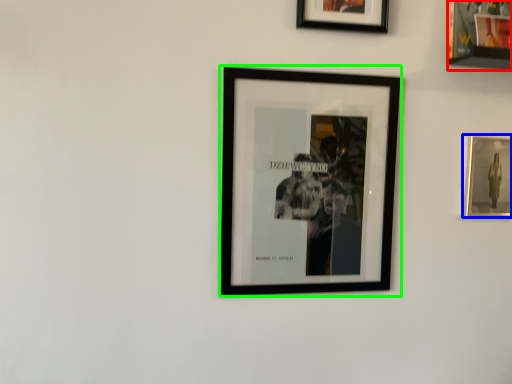
Question: Which object is the closest to the picture frame (highlighted by a red box)? Choose among these: picture frame (highlighted by a blue box) or picture frame (highlighted by a green box).

Choices:
 (A) picture frame
 (B) picture frame

Answer: (A)